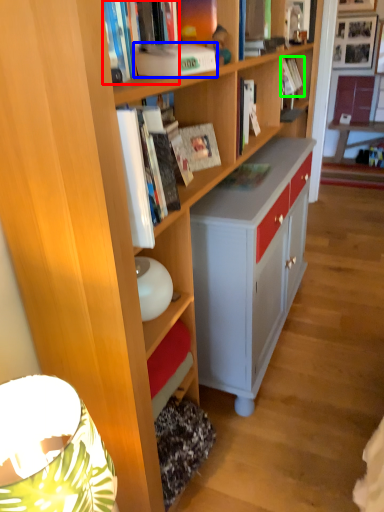
Question: Estimate the real-world distances between objects in this image. Which object is closer to book (highlighted by a red box), paperback book (highlighted by a blue box) or book (highlighted by a green box)?

Choices:
 (A) paperback book
 (B) book

Answer: (A)